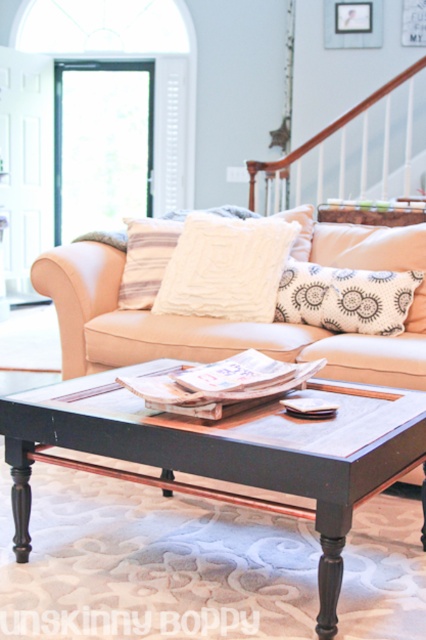
Where is `black wood coffee table at center`? black wood coffee table at center is located at coordinates (224, 451).

Does point (264, 500) come in front of point (411, 280)?

Yes, point (264, 500) is closer to viewer.

This screenshot has height=640, width=426. What are the coordinates of `black wood coffee table at center` in the screenshot? It's located at (224, 451).

Who is more distant from viewer, (x=213, y=230) or (x=313, y=294)?

The point (x=213, y=230) is more distant.

Between white fuzzy pillow at center and white textured pillow at center, which one has less height?

white textured pillow at center is shorter.

What do you see at coordinates (226, 268) in the screenshot?
I see `white fuzzy pillow at center` at bounding box center [226, 268].

You are a GUI agent. You are given a task and a screenshot of the screen. Output one action in this format:
    pyautogui.click(x=<x>, y=<y>)
    Task: Click on the white fuzzy pillow at center
    The height and width of the screenshot is (640, 426).
    Given the screenshot: What is the action you would take?
    pyautogui.click(x=226, y=268)

Is white fuzzy pillow at center below striped fabric pillow at center?

Yes, white fuzzy pillow at center is below striped fabric pillow at center.

Between white fuzzy pillow at center and striped fabric pillow at center, which one is positioned lower?

white fuzzy pillow at center is lower down.

The image size is (426, 640). Find the location of `white fuzzy pillow at center`. white fuzzy pillow at center is located at coordinates (226, 268).